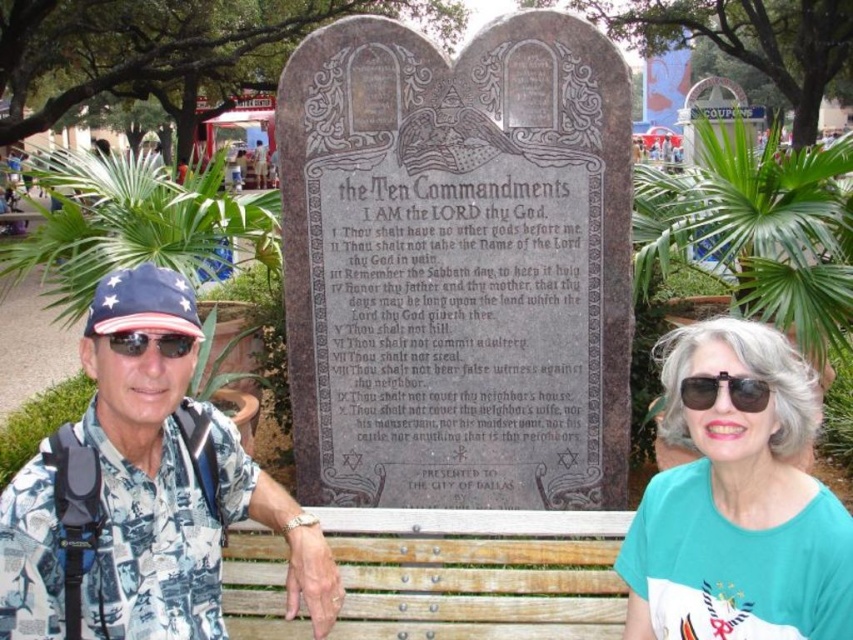
You are a photographer trying to capture a closeup of the white printed shirt at left and the sunglasses at left. Which object should you focus on first if you want to ensure both are in focus?

The white printed shirt at left is positioned on the left side of sunglasses at left, so you should focus on the white printed shirt at left first to ensure both are in focus.

You are a photographer trying to focus on two points in the image. The first point is at coordinate point (62, 445) and the second is at coordinate point (132, 348). Which point should you focus on to ensure it appears sharper in the photo?

Point (62, 445) is closer to the camera than point (132, 348), so focusing on point (62, 445) will make it appear sharper in the photo.